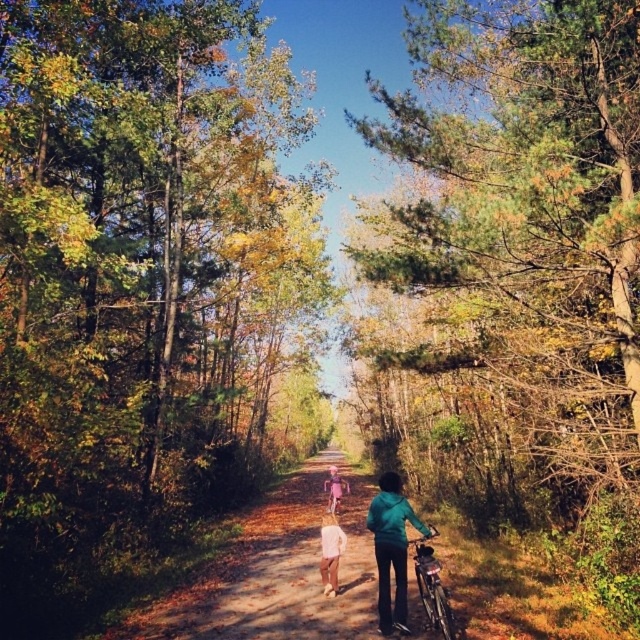
Question: Which point is closer to the camera taking this photo?

Choices:
 (A) pos(198,627)
 (B) pos(540,392)
 (C) pos(417,515)
 (D) pos(342,538)

Answer: (A)

Question: Does green pine tree at center appear on the right side of white cotton shirt at center?

Choices:
 (A) no
 (B) yes

Answer: (B)

Question: Among these points, which one is farthest from the camera?

Choices:
 (A) (342, 509)
 (B) (326, 547)

Answer: (A)

Question: Does brown dirt path at center come behind shiny metallic bicycle at center?

Choices:
 (A) yes
 (B) no

Answer: (A)

Question: Does brown dirt path at center have a lesser width compared to pink fabric dress at center?

Choices:
 (A) no
 (B) yes

Answer: (A)

Question: Which object appears closest to the camera in this image?

Choices:
 (A) green pine tree at center
 (B) shiny metallic bicycle at center

Answer: (B)